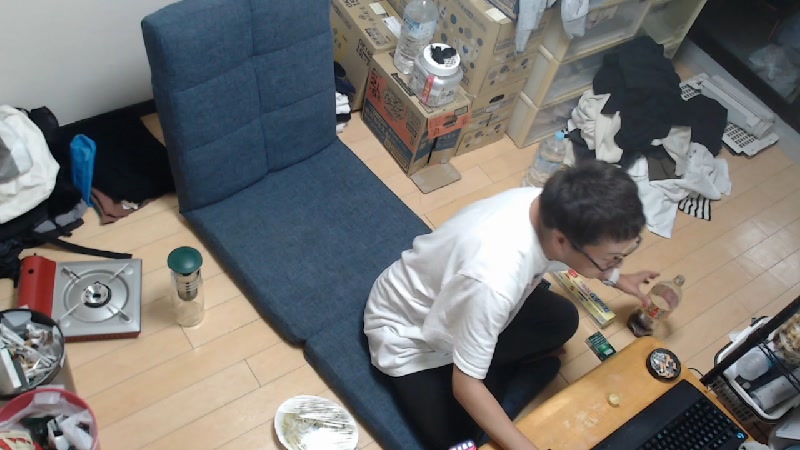
Locate an element on the screen. The image size is (800, 450). box is located at coordinates pos(490,42).